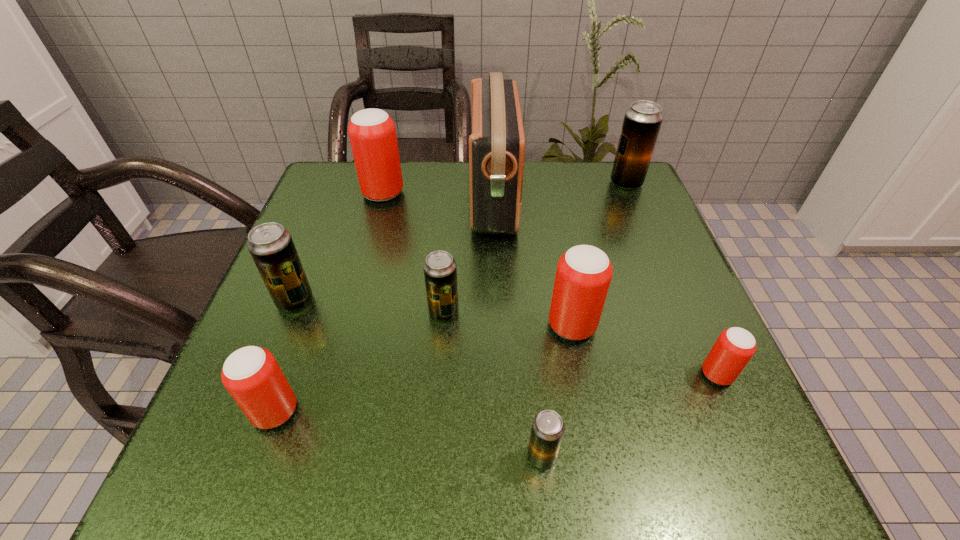
This screenshot has height=540, width=960. In order to click on red beer can object that ranks as the closest to the biggest red beer can in this screenshot , I will do `click(584, 272)`.

I want to click on red beer can that is the second closest to the smallest black beer can, so click(x=735, y=346).

Choose which black beer can is the third nearest neighbor to the rightmost black beer can. Please provide its 2D coordinates. Your answer should be formatted as a tuple, i.e. [(x, y)], where the tuple contains the x and y coordinates of a point satisfying the conditions above.

[(271, 246)]

Identify which black beer can is the closest to the second nearest red beer can. Please provide its 2D coordinates. Your answer should be formatted as a tuple, i.e. [(x, y)], where the tuple contains the x and y coordinates of a point satisfying the conditions above.

[(548, 427)]